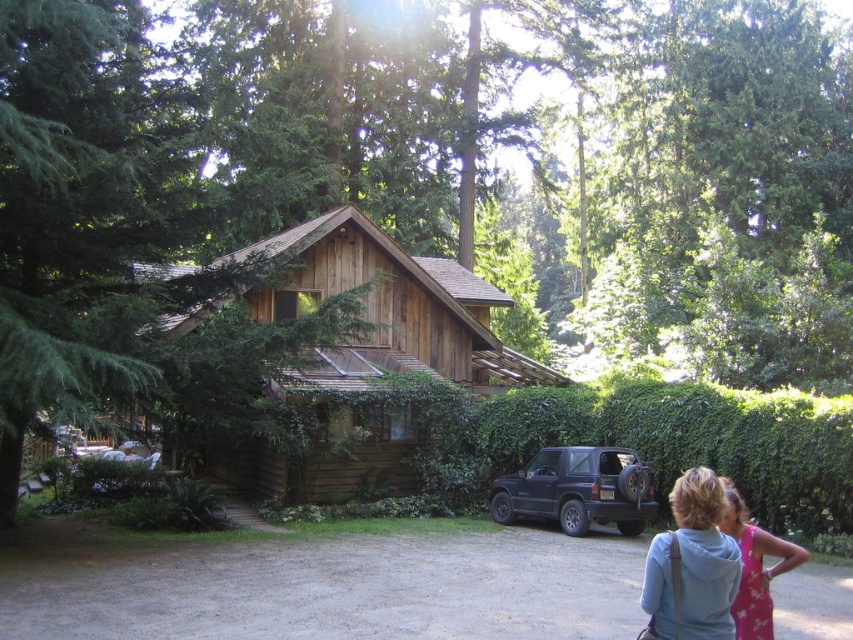
You are standing in front of the cabin and notice both the green leafy hedge at lower right and the pink floral dress at lower right. Which object is closer to you?

The green leafy hedge at lower right is closer to you because it is further to the viewer than the pink floral dress at lower right.